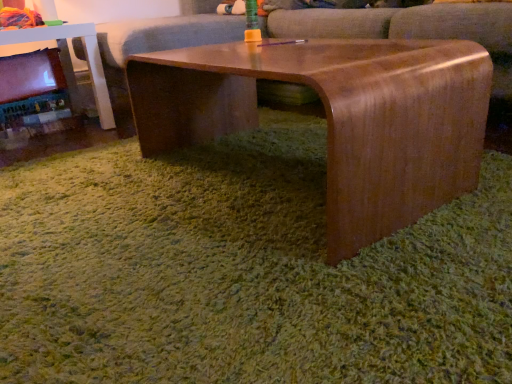
Where is `satin wood swivel chair at center`? satin wood swivel chair at center is located at coordinates (412, 28).

Measure the distance between matte black fireplace at left and camera.

They are 1.78 meters apart.

Locate an element on the screen. Image resolution: width=512 pixels, height=384 pixels. wooden couch at center is located at coordinates (418, 33).

The height and width of the screenshot is (384, 512). I want to click on satin wood swivel chair at center, so click(x=412, y=28).

In the scene shown: Would you consider wooden table at left to be distant from matte black fireplace at left?

That's not correct — wooden table at left is a little close to matte black fireplace at left.

From a real-world perspective, is wooden table at left located higher than matte black fireplace at left?

Yes, from a real-world perspective, wooden table at left is over matte black fireplace at left

Does point (85, 33) come behind point (0, 70)?

No, it is not.

From the image's perspective, is wooden table at left above or below matte black fireplace at left?

Based on their image positions, wooden table at left is located above matte black fireplace at left.

At what (x,y) coordinates should I click in order to perform the action: click on couch above the matte black fireplace at left (from a real-world perspective). Please return your answer as a coordinate pair (x, y). Looking at the image, I should click on (418, 33).

Consider the image. From a real-world perspective, is matte black fireplace at left located higher than wooden couch at center?

No, from a real-world perspective, matte black fireplace at left is not on top of wooden couch at center.

Between matte black fireplace at left and wooden couch at center, which one is positioned in front?

wooden couch at center is more forward.

Which point is more distant from viewer, (56, 51) or (196, 15)?

The point (56, 51) is behind.

Is satin wood coffee table at center turned away from satin wood swivel chair at center?

Correct, satin wood coffee table at center is looking away from satin wood swivel chair at center.

Do you think satin wood coffee table at center is within satin wood swivel chair at center, or outside of it?

satin wood coffee table at center is located beyond the bounds of satin wood swivel chair at center.

I want to click on swivel chair behind the satin wood coffee table at center, so click(412, 28).

Would you say satin wood swivel chair at center is to the left or to the right of matte black fireplace at left in the picture?

Based on their positions, satin wood swivel chair at center is located to the right of matte black fireplace at left.

Is satin wood swivel chair at center not inside matte black fireplace at left?

satin wood swivel chair at center lies outside matte black fireplace at left's area.

Who is taller, satin wood swivel chair at center or matte black fireplace at left?

satin wood swivel chair at center.

Is satin wood swivel chair at center turned away from matte black fireplace at left?

No, satin wood swivel chair at center is not facing the opposite direction of matte black fireplace at left.

Between point (120, 100) and point (2, 124), which one is positioned behind?

The point (120, 100) is farther from the camera.

Find the location of a particular element. This screenshot has height=384, width=512. couch on the right of matte black fireplace at left is located at coordinates (418, 33).

Who is shorter, wooden couch at center or matte black fireplace at left?

matte black fireplace at left.

How many degrees apart are the facing directions of satin wood coffee table at center and wooden couch at center?

The angle between the facing direction of satin wood coffee table at center and the facing direction of wooden couch at center is 2.04 degrees.

From the image's perspective, which object appears higher, satin wood coffee table at center or wooden couch at center?

wooden couch at center is shown above in the image.

Locate an element on the screen. This screenshot has width=512, height=384. couch above the satin wood coffee table at center (from the image's perspective) is located at coordinates (418, 33).

Measure the distance between wooden table at left and satin wood swivel chair at center.

A distance of 1.03 meters exists between wooden table at left and satin wood swivel chair at center.

Between wooden table at left and satin wood swivel chair at center, which one appears on the right side from the viewer's perspective?

satin wood swivel chair at center is more to the right.

In terms of size, does wooden table at left appear bigger or smaller than satin wood swivel chair at center?

Considering their sizes, wooden table at left takes up less space than satin wood swivel chair at center.

Which object is further away from the camera, wooden table at left or satin wood swivel chair at center?

Positioned behind is wooden table at left.

This screenshot has height=384, width=512. What are the coordinates of `fireplace that is behind the wooden table at left` in the screenshot? It's located at (31, 85).

Locate an element on the screen. This screenshot has height=384, width=512. fireplace lying on the left of wooden couch at center is located at coordinates (31, 85).

From the image, which object appears to be farther from satin wood coffee table at center, wooden table at left or satin wood swivel chair at center?

The object further to satin wood coffee table at center is wooden table at left.

Looking at the image, which one is located closer to matte black fireplace at left, satin wood swivel chair at center or wooden couch at center?

wooden couch at center lies closer to matte black fireplace at left than the other object.

Estimate the real-world distances between objects in this image. Which object is further from satin wood swivel chair at center, wooden table at left or matte black fireplace at left?

matte black fireplace at left is positioned further to the anchor satin wood swivel chair at center.

Looking at the image, which one is located closer to satin wood coffee table at center, wooden table at left or matte black fireplace at left?

wooden table at left is positioned closer to the anchor satin wood coffee table at center.

Which object lies further to the anchor point wooden table at left, matte black fireplace at left or wooden couch at center?

wooden couch at center is further to wooden table at left.

Considering their positions, is matte black fireplace at left positioned further to wooden table at left than satin wood swivel chair at center?

satin wood swivel chair at center.

Looking at the image, which one is located closer to satin wood coffee table at center, wooden couch at center or matte black fireplace at left?

wooden couch at center is closer to satin wood coffee table at center.

In the scene shown: From the image, which object appears to be nearer to matte black fireplace at left, satin wood coffee table at center or wooden table at left?

wooden table at left lies closer to matte black fireplace at left than the other object.

This screenshot has height=384, width=512. I want to click on coffee table situated between matte black fireplace at left and satin wood swivel chair at center from left to right, so click(x=337, y=118).

Locate an element on the screen. The image size is (512, 384). couch located between matte black fireplace at left and satin wood swivel chair at center in the left-right direction is located at coordinates (418, 33).

The width and height of the screenshot is (512, 384). Find the location of `couch between wooden table at left and satin wood swivel chair at center from left to right`. couch between wooden table at left and satin wood swivel chair at center from left to right is located at coordinates (418, 33).

The width and height of the screenshot is (512, 384). I want to click on couch situated between wooden table at left and satin wood coffee table at center from left to right, so click(418, 33).